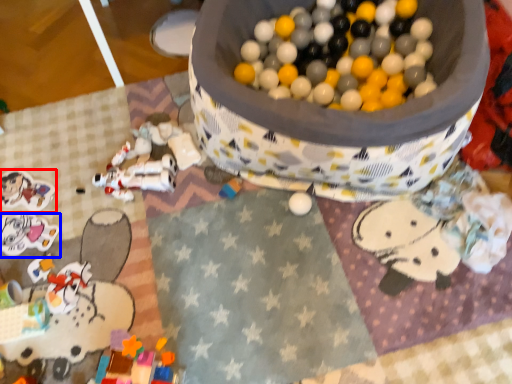
Question: Among these objects, which one is farthest to the camera, toy (highlighted by a red box) or toy (highlighted by a blue box)?

Choices:
 (A) toy
 (B) toy

Answer: (A)